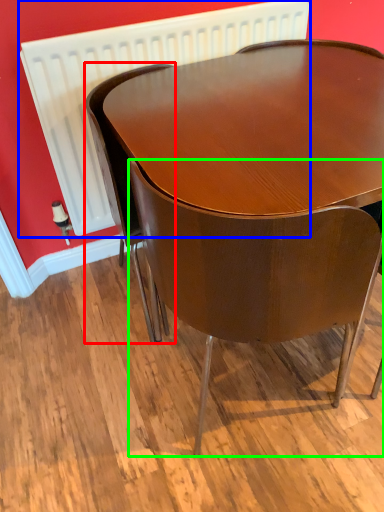
Question: Considering the real-world distances, which object is farthest from chair (highlighted by a red box)? radiator (highlighted by a blue box) or chair (highlighted by a green box)?

Choices:
 (A) radiator
 (B) chair

Answer: (B)